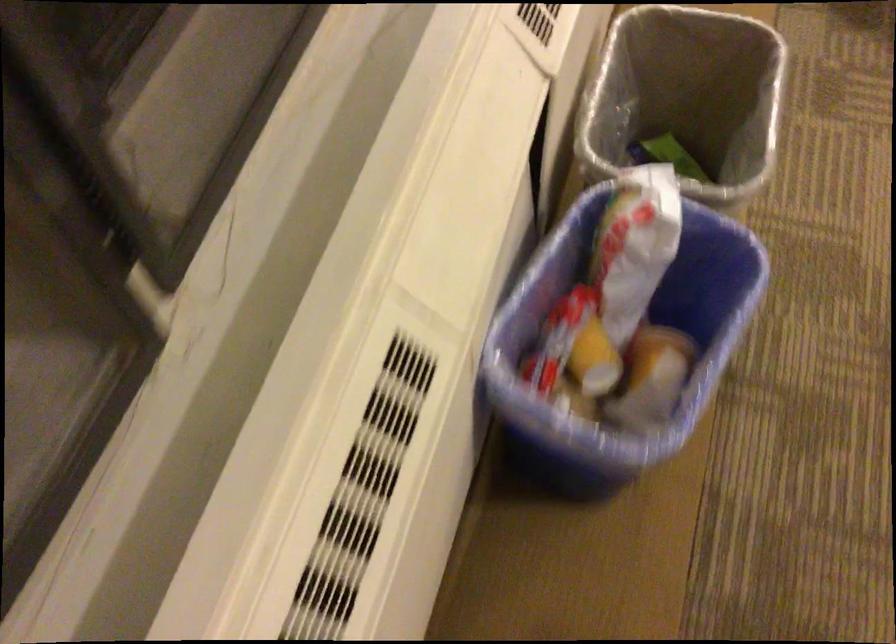
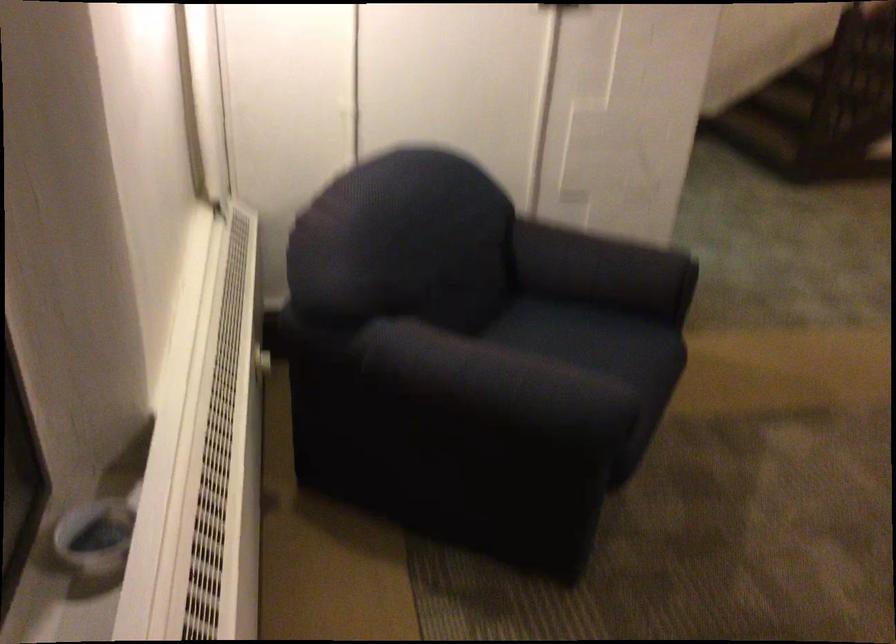
The first image is from the beginning of the video and the second image is from the end. How did the camera likely rotate when shooting the video?

The rotation direction of the camera is right-up.